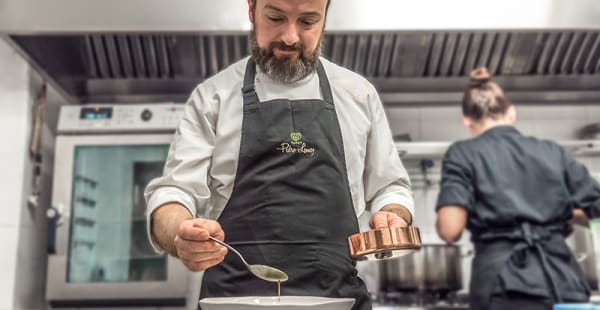
You are a GUI agent. You are given a task and a screenshot of the screen. Output one action in this format:
    pyautogui.click(x=<x>, y=<y>)
    Task: Click on the spoon
    
    Given the screenshot: What is the action you would take?
    pyautogui.click(x=270, y=270)